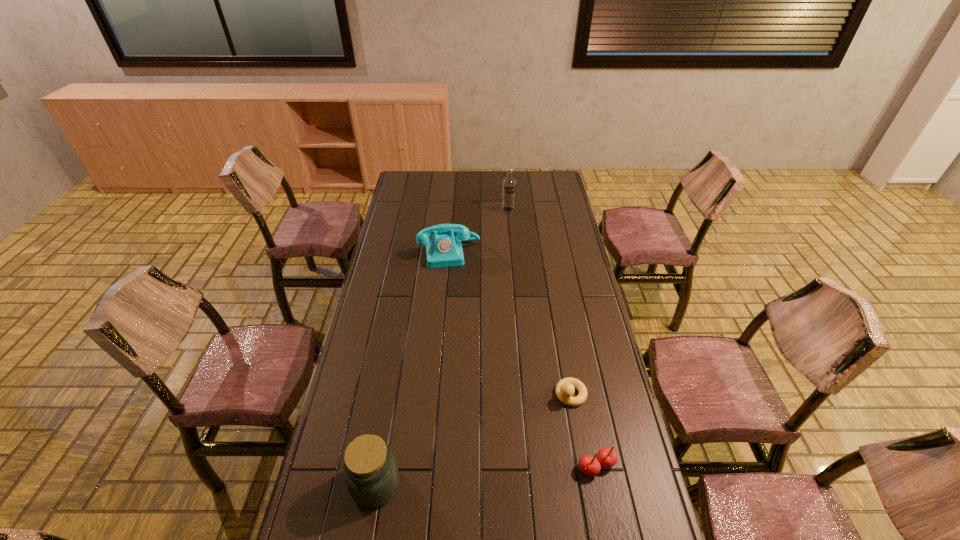
Image resolution: width=960 pixels, height=540 pixels. What are the coordinates of `vacant area that lies between the duckling and the cherry` in the screenshot? It's located at (584, 430).

Locate an element on the screen. The height and width of the screenshot is (540, 960). free area in between the shortest object and the jar is located at coordinates (473, 439).

Identify the location of unoccupied area between the cherry and the farthest object. The height and width of the screenshot is (540, 960). (552, 338).

You are a GUI agent. You are given a task and a screenshot of the screen. Output one action in this format:
    pyautogui.click(x=<x>, y=<y>)
    Task: Click on the vacant area that lies between the third nearest object and the cherry
    
    Given the screenshot: What is the action you would take?
    pyautogui.click(x=584, y=430)

I want to click on empty location between the duckling and the jar, so click(473, 439).

At what (x,y) coordinates should I click in order to perform the action: click on free space between the second farthest object and the third farthest object. Please return your answer as a coordinate pair (x, y). Looking at the image, I should click on (510, 323).

Where is `vacant space that's between the telephone and the cherry`? The image size is (960, 540). vacant space that's between the telephone and the cherry is located at coordinates (523, 360).

Point out which object is positioned as the fourth nearest to the jar. Please provide its 2D coordinates. Your answer should be formatted as a tuple, i.e. [(x, y)], where the tuple contains the x and y coordinates of a point satisfying the conditions above.

[(508, 197)]

Locate an element on the screen. The width and height of the screenshot is (960, 540). the fourth closest object to the jar is located at coordinates (508, 197).

You are a GUI agent. You are given a task and a screenshot of the screen. Output one action in this format:
    pyautogui.click(x=<x>, y=<y>)
    Task: Click on the vacant region that satisfies the following two spatial constraints: 1. on the back side of the vodka; 2. on the left side of the second farthest object
    Image resolution: width=960 pixels, height=540 pixels.
    Given the screenshot: What is the action you would take?
    coord(453,210)